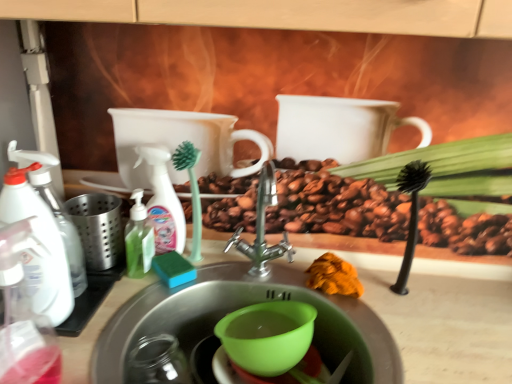
Find the location of `vacant space that is in between green plastic spray bottle at center, positioned as the third cleaning product in left-to-right order, and orange fabric at sink`. vacant space that is in between green plastic spray bottle at center, positioned as the third cleaning product in left-to-right order, and orange fabric at sink is located at coordinates (255, 274).